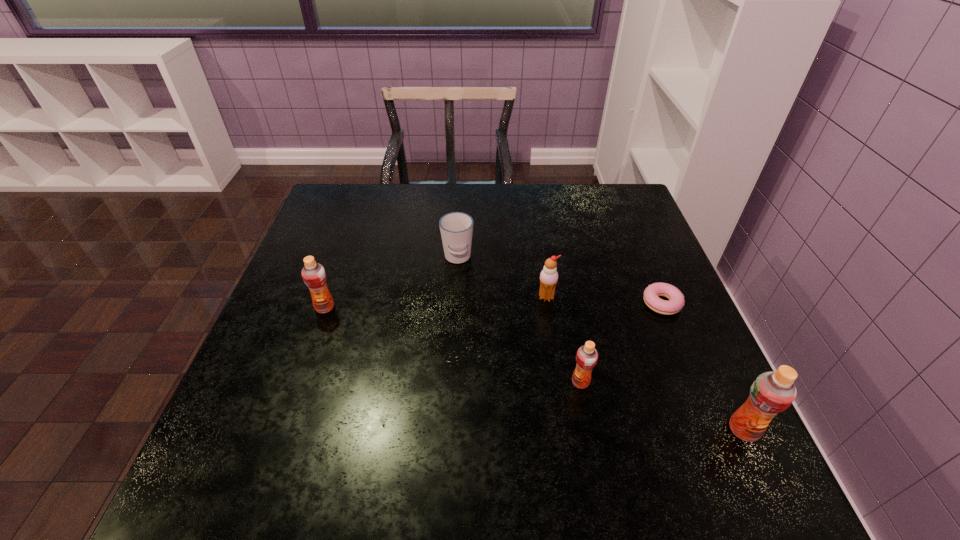
Where is `the farthest orange juice`? The height and width of the screenshot is (540, 960). the farthest orange juice is located at coordinates (314, 276).

The height and width of the screenshot is (540, 960). What are the coordinates of `the leftmost orange juice` in the screenshot? It's located at (314, 276).

Locate an element on the screen. the third object from right to left is located at coordinates (586, 357).

What are the coordinates of `the second farthest orange juice` in the screenshot? It's located at (586, 357).

The width and height of the screenshot is (960, 540). I want to click on the rightmost orange juice, so click(x=771, y=393).

The height and width of the screenshot is (540, 960). I want to click on the nearest orange juice, so click(771, 393).

Locate an element on the screen. This screenshot has width=960, height=540. the farthest object is located at coordinates pos(456,228).

Locate an element on the screen. The image size is (960, 540). cup is located at coordinates [456, 228].

You are a GUI agent. You are given a task and a screenshot of the screen. Output one action in this format:
    pyautogui.click(x=<x>, y=<y>)
    Task: Click on the shortest object
    
    Given the screenshot: What is the action you would take?
    pyautogui.click(x=676, y=302)

I want to click on icecream, so click(549, 276).